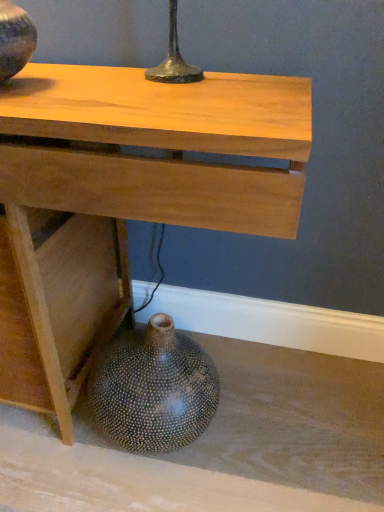
This screenshot has height=512, width=384. I want to click on speckled ceramic vase at lower left, the 2th vase viewed from the top, so click(153, 388).

Which point is more forward, (26,37) or (150,416)?

Point (26,37)

Considering the relative positions of matte black vase at upper left, placed as the 2th vase when sorted from back to front, and speckled ceramic vase at lower left, the second vase in the left-to-right sequence, in the image provided, is matte black vase at upper left, placed as the 2th vase when sorted from back to front, to the right of speckled ceramic vase at lower left, the second vase in the left-to-right sequence, from the viewer's perspective?

No.

Is matte black vase at upper left, arranged as the first vase when viewed from the top, turned away from speckled ceramic vase at lower left, the 1th vase when ordered from right to left?

No, speckled ceramic vase at lower left, the 1th vase when ordered from right to left, is not at the back of matte black vase at upper left, arranged as the first vase when viewed from the top.

Which is behind, matte black vase at upper left, arranged as the first vase when viewed from the top, or speckled ceramic vase at lower left, the second vase positioned from the front?

speckled ceramic vase at lower left, the second vase positioned from the front.

Is speckled ceramic vase at lower left, the second vase positioned from the front, at the back of natural wood table at center?

Yes, natural wood table at center's orientation is away from speckled ceramic vase at lower left, the second vase positioned from the front.

How much distance is there between natural wood table at center and speckled ceramic vase at lower left, arranged as the first vase when ordered from the bottom?

11.88 inches.

Considering the sizes of objects natural wood table at center and speckled ceramic vase at lower left, placed as the 1th vase when sorted from back to front, in the image provided, who is shorter, natural wood table at center or speckled ceramic vase at lower left, placed as the 1th vase when sorted from back to front,?

speckled ceramic vase at lower left, placed as the 1th vase when sorted from back to front, is shorter.

Considering the sizes of objects natural wood table at center and speckled ceramic vase at lower left, the second vase in the left-to-right sequence, in the image provided, who is smaller, natural wood table at center or speckled ceramic vase at lower left, the second vase in the left-to-right sequence,?

speckled ceramic vase at lower left, the second vase in the left-to-right sequence, is smaller.

Does natural wood table at center have a lesser height compared to matte black vase at upper left, placed as the 2th vase when sorted from back to front?

No, natural wood table at center is not shorter than matte black vase at upper left, placed as the 2th vase when sorted from back to front.

Can you confirm if natural wood table at center is wider than matte black vase at upper left, placed as the 2th vase when sorted from back to front?

Indeed, natural wood table at center has a greater width compared to matte black vase at upper left, placed as the 2th vase when sorted from back to front.

Is natural wood table at center positioned before matte black vase at upper left, arranged as the first vase when viewed from the top?

Yes, natural wood table at center is closer to the camera.

From the image's perspective, who appears lower, natural wood table at center or matte black vase at upper left, which is the 2th vase from right to left?

natural wood table at center is shown below in the image.

Consider the image. Which object is further away from the camera taking this photo, speckled ceramic vase at lower left, the second vase in the left-to-right sequence, or matte black vase at upper left, placed as the 2th vase when sorted from back to front?

Positioned behind is speckled ceramic vase at lower left, the second vase in the left-to-right sequence.

Is speckled ceramic vase at lower left, placed as the 1th vase when sorted from back to front, facing away from matte black vase at upper left, the second vase when ordered from bottom to top?

No, speckled ceramic vase at lower left, placed as the 1th vase when sorted from back to front,'s orientation is not away from matte black vase at upper left, the second vase when ordered from bottom to top.

From a real-world perspective, is speckled ceramic vase at lower left, placed as the 1th vase when sorted from back to front, located beneath matte black vase at upper left, placed as the 2th vase when sorted from back to front?

Yes, from a real-world perspective, speckled ceramic vase at lower left, placed as the 1th vase when sorted from back to front, is below matte black vase at upper left, placed as the 2th vase when sorted from back to front.

Is speckled ceramic vase at lower left, the second vase in the left-to-right sequence, next to matte black vase at upper left, arranged as the first vase when viewed from the left, and touching it?

speckled ceramic vase at lower left, the second vase in the left-to-right sequence, and matte black vase at upper left, arranged as the first vase when viewed from the left, are clearly separated.

Who is taller, matte black vase at upper left, placed as the 2th vase when sorted from back to front, or natural wood table at center?

natural wood table at center.

Considering the positions of objects matte black vase at upper left, placed as the 2th vase when sorted from back to front, and natural wood table at center in the image provided, who is more to the right, matte black vase at upper left, placed as the 2th vase when sorted from back to front, or natural wood table at center?

natural wood table at center.

Does matte black vase at upper left, placed as the 2th vase when sorted from back to front, lie behind natural wood table at center?

Yes, matte black vase at upper left, placed as the 2th vase when sorted from back to front, is further from the viewer.

Which point is more distant from viewer, (217, 406) or (70, 281)?

The point (217, 406) is behind.

Could natural wood table at center be considered to be inside speckled ceramic vase at lower left, the 2th vase viewed from the top?

No, natural wood table at center is not surrounded by speckled ceramic vase at lower left, the 2th vase viewed from the top.

Image resolution: width=384 pixels, height=512 pixels. I want to click on vase that is the 2nd object located behind the natural wood table at center, so click(153, 388).

Between speckled ceramic vase at lower left, the second vase positioned from the front, and natural wood table at center, which one has larger width?

With larger width is natural wood table at center.

The image size is (384, 512). I want to click on vase on the right of matte black vase at upper left, arranged as the first vase when viewed from the front, so click(153, 388).

Where is `table above the speckled ceramic vase at lower left, placed as the 1th vase when sorted from back to front (from the image's perspective)`? The image size is (384, 512). table above the speckled ceramic vase at lower left, placed as the 1th vase when sorted from back to front (from the image's perspective) is located at coordinates (124, 199).

Based on their spatial positions, is natural wood table at center or matte black vase at upper left, placed as the 2th vase when sorted from back to front, further from speckled ceramic vase at lower left, the second vase in the left-to-right sequence?

The object further to speckled ceramic vase at lower left, the second vase in the left-to-right sequence, is matte black vase at upper left, placed as the 2th vase when sorted from back to front.

From the image, which object appears to be farther from natural wood table at center, speckled ceramic vase at lower left, placed as the 1th vase when sorted from back to front, or matte black vase at upper left, the second vase when ordered from bottom to top?

The object further to natural wood table at center is matte black vase at upper left, the second vase when ordered from bottom to top.

From the image, which object appears to be farther from matte black vase at upper left, arranged as the first vase when viewed from the left, speckled ceramic vase at lower left, arranged as the first vase when ordered from the bottom, or natural wood table at center?

speckled ceramic vase at lower left, arranged as the first vase when ordered from the bottom, lies further to matte black vase at upper left, arranged as the first vase when viewed from the left, than the other object.

Consider the image. Looking at the image, which one is located further to natural wood table at center, matte black vase at upper left, the second vase when ordered from bottom to top, or speckled ceramic vase at lower left, the 1th vase when ordered from right to left?

matte black vase at upper left, the second vase when ordered from bottom to top, is positioned further to the anchor natural wood table at center.

When comparing their distances from matte black vase at upper left, arranged as the first vase when viewed from the top, does natural wood table at center or speckled ceramic vase at lower left, placed as the 1th vase when sorted from back to front, seem closer?

natural wood table at center is positioned closer to the anchor matte black vase at upper left, arranged as the first vase when viewed from the top.

From the image, which object appears to be nearer to speckled ceramic vase at lower left, arranged as the first vase when ordered from the bottom, matte black vase at upper left, placed as the 2th vase when sorted from back to front, or natural wood table at center?

The object closer to speckled ceramic vase at lower left, arranged as the first vase when ordered from the bottom, is natural wood table at center.

This screenshot has width=384, height=512. What are the coordinates of `table between matte black vase at upper left, arranged as the first vase when viewed from the top, and speckled ceramic vase at lower left, the second vase in the left-to-right sequence, vertically` in the screenshot? It's located at (124, 199).